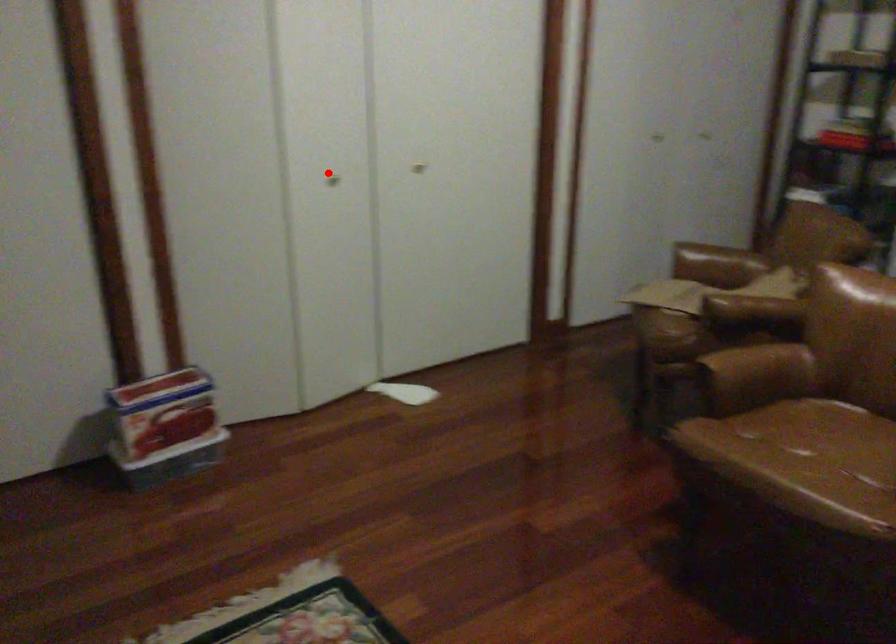
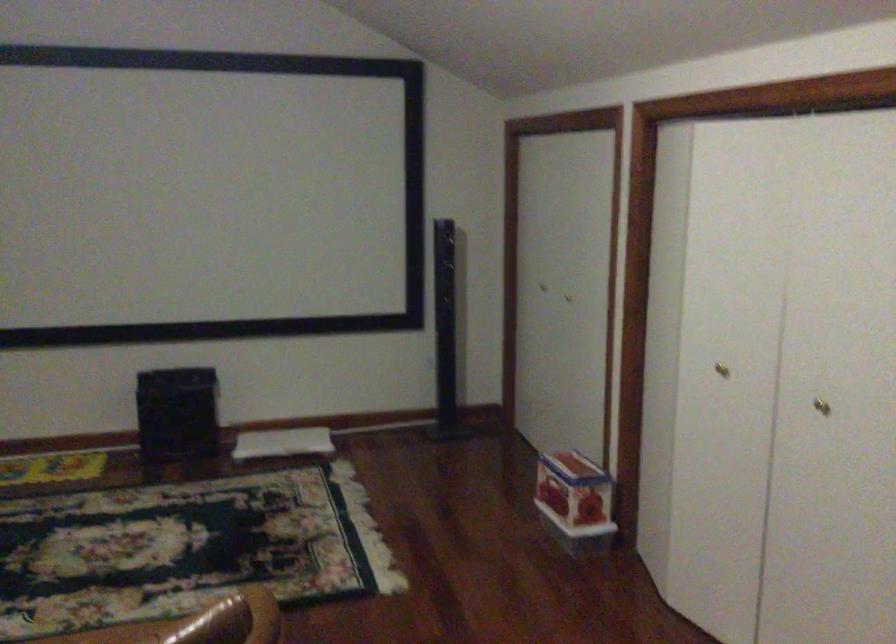
The point at the highlighted location is marked in the first image. Where is the corresponding point in the second image?

(721, 368)